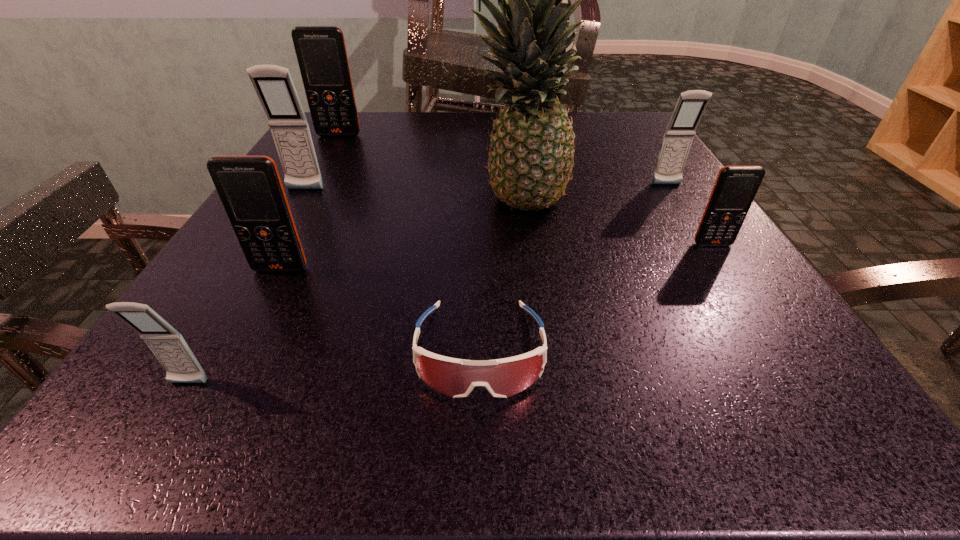
Image resolution: width=960 pixels, height=540 pixels. Find the location of `the second nearest orange cellular telephone`. the second nearest orange cellular telephone is located at coordinates (735, 188).

Image resolution: width=960 pixels, height=540 pixels. Identify the location of the rightmost orange cellular telephone. (735, 188).

Image resolution: width=960 pixels, height=540 pixels. I want to click on the nearest gray cellular telephone, so click(167, 344).

Where is `the smallest gray cellular telephone`? Image resolution: width=960 pixels, height=540 pixels. the smallest gray cellular telephone is located at coordinates (167, 344).

You are a GUI agent. You are given a task and a screenshot of the screen. Output one action in this format:
    pyautogui.click(x=<x>, y=<y>)
    Task: Click on the shortest object
    Image resolution: width=960 pixels, height=540 pixels.
    Given the screenshot: What is the action you would take?
    pyautogui.click(x=456, y=378)

Where is `goggles`? goggles is located at coordinates (456, 378).

You are a GUI agent. You are given a task and a screenshot of the screen. Output one action in this format:
    pyautogui.click(x=<x>, y=<y>)
    Task: Click on the free space located on the front of the tallest object
    The height and width of the screenshot is (540, 960).
    Given the screenshot: What is the action you would take?
    pyautogui.click(x=523, y=258)

Locate an element on the screen. vacant space situated on the screen of the farthest orange cellular telephone is located at coordinates (544, 179).

In order to click on vacant space located on the front-facing side of the biggest gray cellular telephone in this screenshot , I will do `click(280, 232)`.

The image size is (960, 540). Find the location of `vacant space located 0.350m on the screen of the third nearest orange cellular telephone`. vacant space located 0.350m on the screen of the third nearest orange cellular telephone is located at coordinates (287, 225).